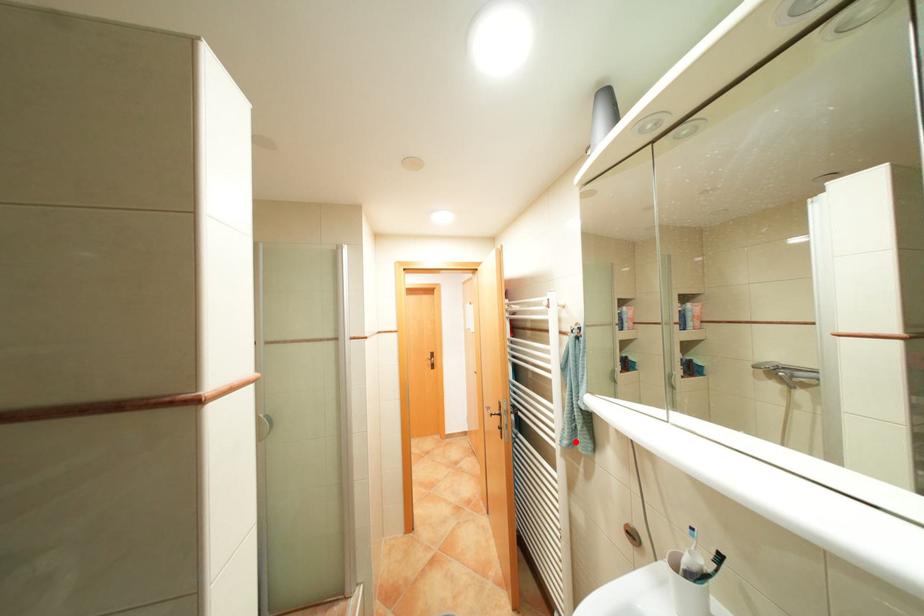
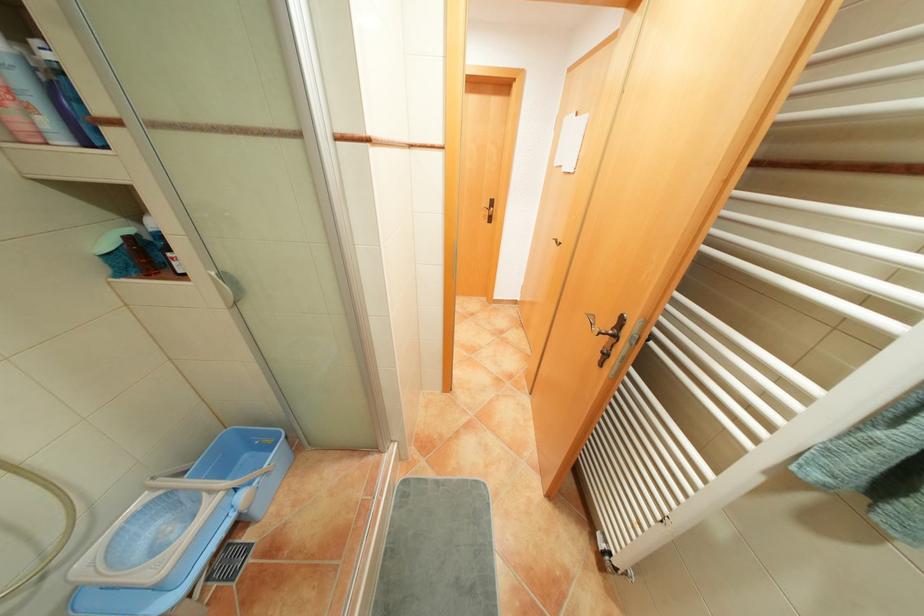
In the second image, find the point that corresponds to the highlighted location in the first image.

(828, 475)